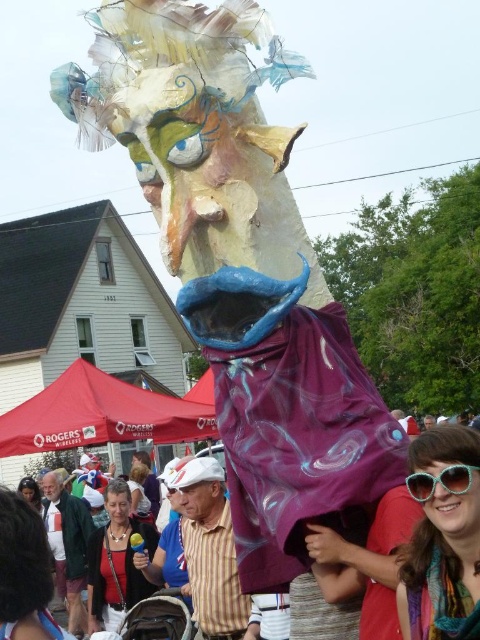
Question: Is metallic silver umbrella at center below sunglasses at lower right?

Choices:
 (A) yes
 (B) no

Answer: (A)

Question: Can you confirm if metallic silver umbrella at center is bigger than sunglasses at lower right?

Choices:
 (A) yes
 (B) no

Answer: (A)

Question: Among these points, which one is farthest from the camera?

Choices:
 (A) (420, 524)
 (B) (427, 474)

Answer: (A)

Question: Is metallic silver umbrella at center positioned at the back of sunglasses at lower right?

Choices:
 (A) no
 (B) yes

Answer: (A)